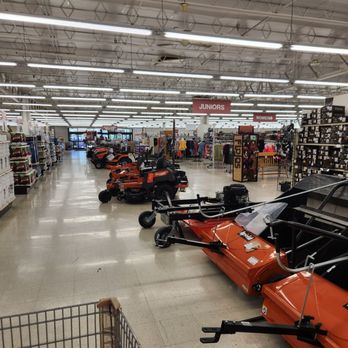
Find the location of a particular element. This screenshot has height=348, width=348. glass door is located at coordinates (73, 136), (80, 135), (110, 135), (119, 136), (126, 136).